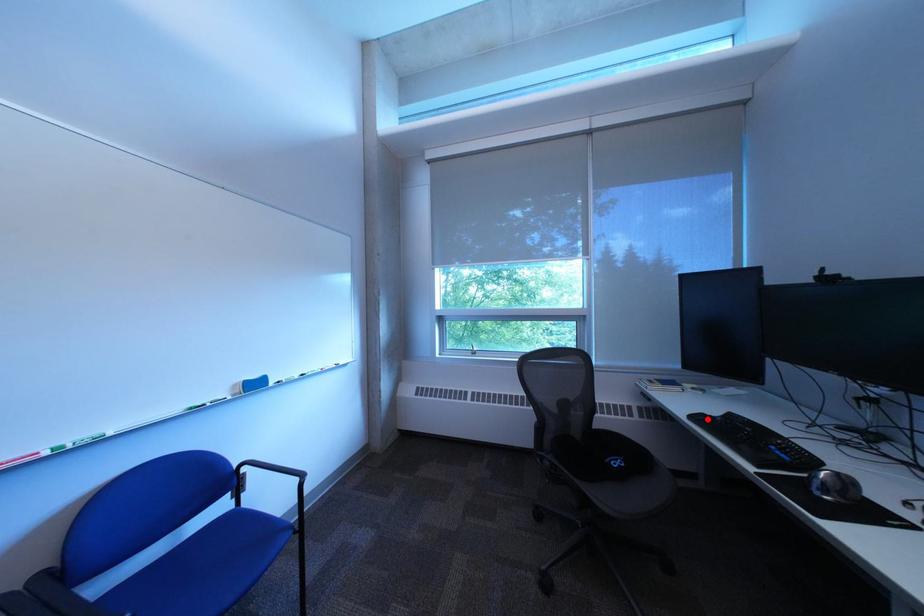
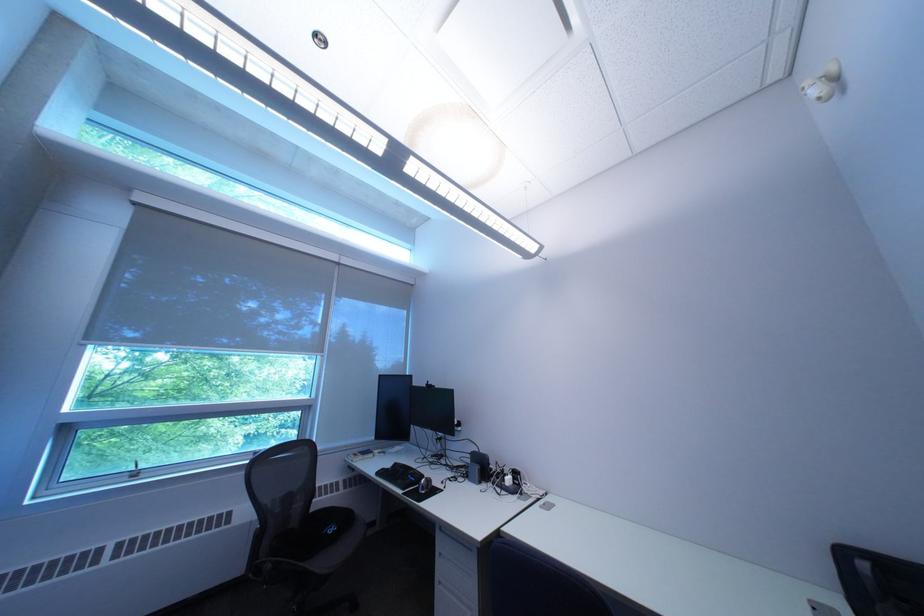
In the second image, find the point that corresponds to the highlighted location in the first image.

(393, 475)